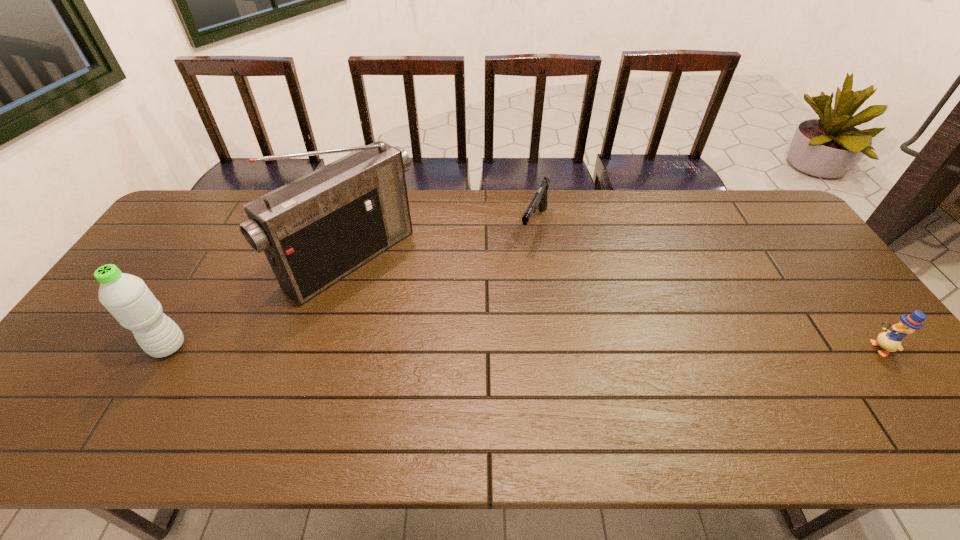
Find the location of `free spot between the gun and the duckling`. free spot between the gun and the duckling is located at coordinates point(708,286).

The height and width of the screenshot is (540, 960). I want to click on free space between the tallest object and the second tallest object, so click(x=260, y=303).

The height and width of the screenshot is (540, 960). In order to click on vacant area that lies between the gun and the second object from left to right in this screenshot , I will do `click(444, 243)`.

Image resolution: width=960 pixels, height=540 pixels. I want to click on free spot between the gun and the water bottle, so click(x=351, y=286).

Locate which object ranks second in proximity to the gun. Please provide its 2D coordinates. Your answer should be formatted as a tuple, i.e. [(x, y)], where the tuple contains the x and y coordinates of a point satisfying the conditions above.

[(891, 341)]

The image size is (960, 540). I want to click on object that is the third closest to the second tallest object, so click(891, 341).

Find the location of a particular element. free space that satisfies the following two spatial constraints: 1. on the front side of the third object from right to left; 2. on the face of the duckling, where the monocle is placed is located at coordinates (327, 348).

This screenshot has height=540, width=960. I want to click on free region that satisfies the following two spatial constraints: 1. on the back side of the second object from right to left; 2. on the right side of the radio receiver, so (x=363, y=225).

Find the location of a particular element. This screenshot has height=540, width=960. vacant space that satisfies the following two spatial constraints: 1. on the front side of the rightmost object; 2. on the face of the tallest object, where the monocle is placed is located at coordinates (327, 348).